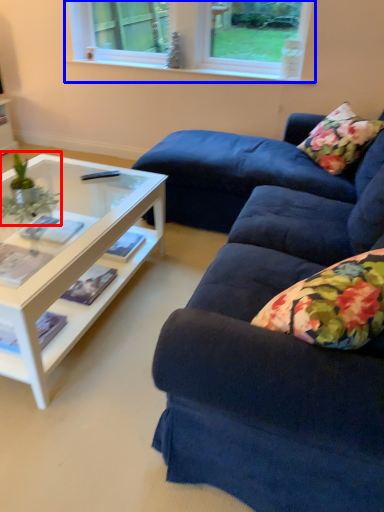
Question: Which object appears farthest to the camera in this image, houseplant (highlighted by a red box) or window (highlighted by a blue box)?

Choices:
 (A) houseplant
 (B) window

Answer: (B)